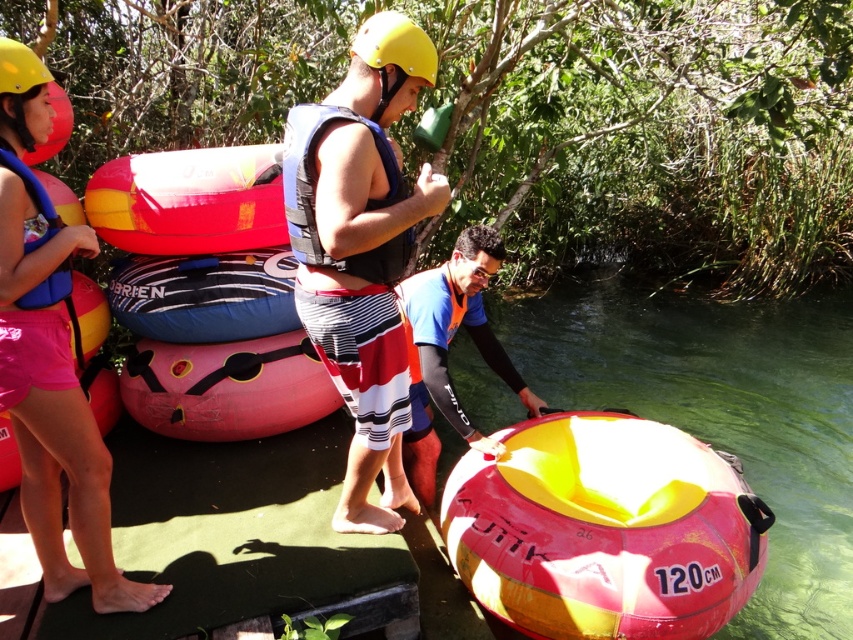
Question: Which object is closer to the camera taking this photo?

Choices:
 (A) pink rubber tube at lower right
 (B) yellow matte helmet at center
 (C) blue fabric life jacket at center

Answer: (C)

Question: Among these points, which one is farthest from the camera?

Choices:
 (A) (39, 193)
 (B) (430, 369)
 (C) (212, 202)

Answer: (C)

Question: Can you confirm if pink rubber tube at lower right is bigger than yellow matte tube at center?

Choices:
 (A) no
 (B) yes

Answer: (B)

Question: Can you confirm if matte black life vest at center is thinner than yellow matte helmet at center?

Choices:
 (A) yes
 (B) no

Answer: (B)

Question: Among these objects, which one is nearest to the camera?

Choices:
 (A) blue fabric tube at center
 (B) yellow matte tube at center
 (C) yellow matte helmet at center

Answer: (C)

Question: Can you confirm if matte black life vest at center is smaller than yellow matte tube at center?

Choices:
 (A) no
 (B) yes

Answer: (A)